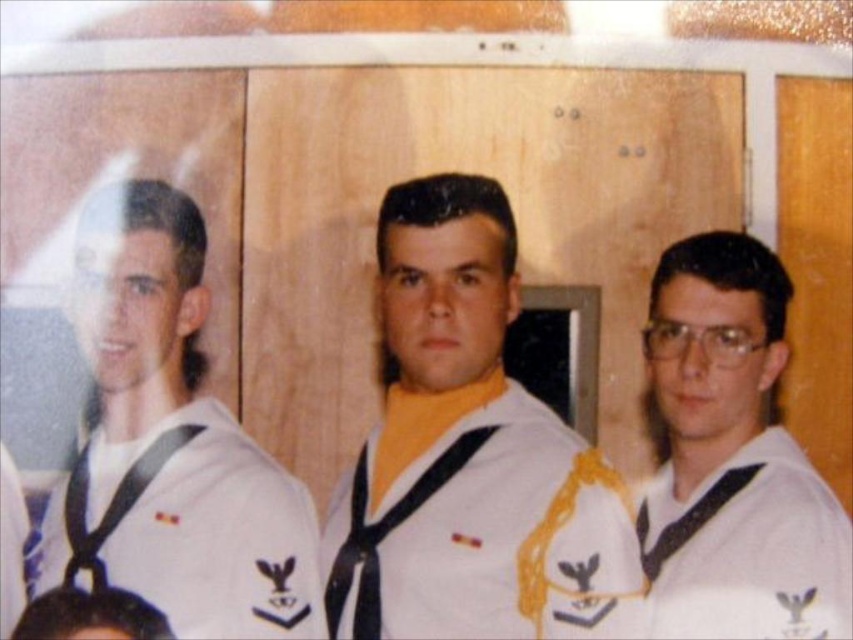
You are a photographer setting up a shoot in the room with the wooden wall. You need to position a camera on a tripod so that both the white matte uniform at center and the white matte sailor uniform at right are in frame. Given their height difference, which uniform should you adjust the tripod height to focus on to ensure both are visible?

The white matte uniform at center is much taller than the white matte sailor uniform at right, so adjusting the tripod height to focus on the white matte uniform at center will ensure both are visible in the frame.